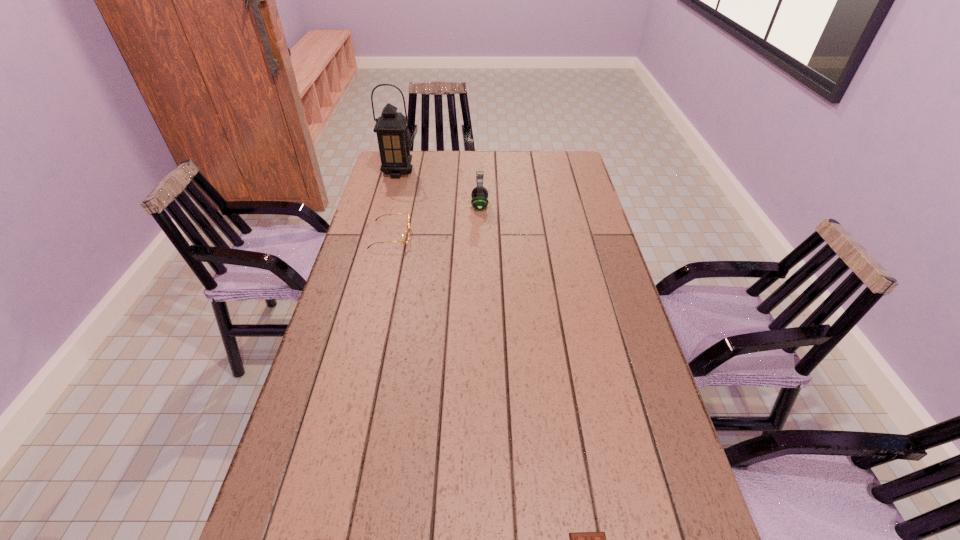
Where is `lantern that is at the left edge`? The height and width of the screenshot is (540, 960). lantern that is at the left edge is located at coordinates (391, 128).

Where is `spectacles that is at the left edge`? spectacles that is at the left edge is located at coordinates (405, 236).

You are a GUI agent. You are given a task and a screenshot of the screen. Output one action in this format:
    pyautogui.click(x=<x>, y=<y>)
    Task: Click on the object situated at the far left corner
    This screenshot has height=540, width=960.
    Given the screenshot: What is the action you would take?
    pyautogui.click(x=391, y=128)

The image size is (960, 540). In order to click on vacant position at the far edge of the desktop in this screenshot , I will do `click(501, 168)`.

Image resolution: width=960 pixels, height=540 pixels. In the image, there is a desktop. Identify the location of vacant area at the left edge. (323, 341).

In the image, there is a desktop. At what (x,y) coordinates should I click in order to perform the action: click on vacant space at the right edge. Please return your answer as a coordinate pair (x, y). The height and width of the screenshot is (540, 960). Looking at the image, I should click on (596, 371).

Locate which object is the second closest to the third farthest object. Please provide its 2D coordinates. Your answer should be formatted as a tuple, i.e. [(x, y)], where the tuple contains the x and y coordinates of a point satisfying the conditions above.

[(391, 128)]

Identify which object is the second closest to the shortest object. Please provide its 2D coordinates. Your answer should be formatted as a tuple, i.e. [(x, y)], where the tuple contains the x and y coordinates of a point satisfying the conditions above.

[(479, 194)]